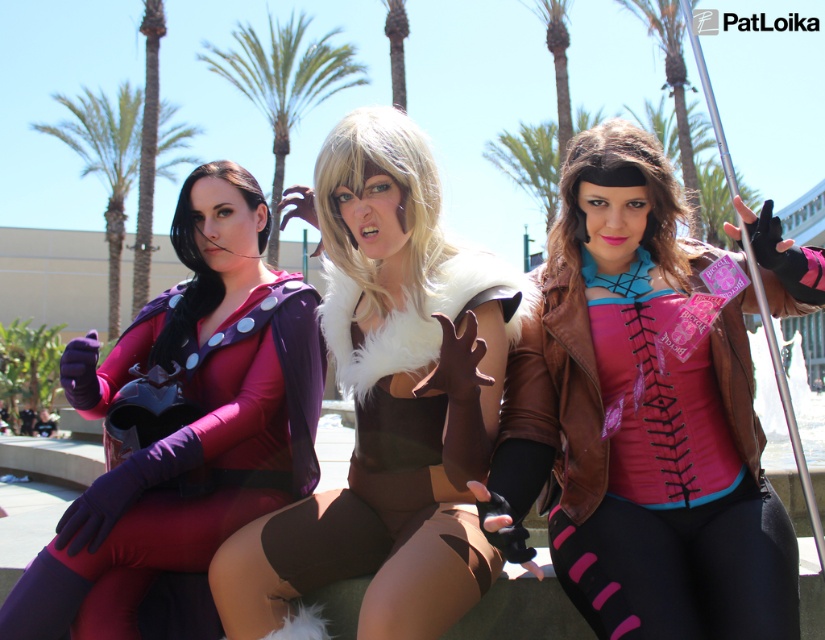
Question: Among these points, which one is nearest to the camera?

Choices:
 (A) click(307, 20)
 (B) click(343, 260)

Answer: (B)

Question: Is the position of brown fur vest at center more distant than that of green leafy palm tree at left?

Choices:
 (A) yes
 (B) no

Answer: (B)

Question: Estimate the real-world distances between objects in this image. Which object is farther from the matte purple bodysuit at left?

Choices:
 (A) green leafy palm tree at left
 (B) pink leather vest at center
 (C) green leafy palm tree at upper center
 (D) brown fur vest at center

Answer: (A)

Question: Is brown fur vest at center above green leafy palm tree at left?

Choices:
 (A) yes
 (B) no

Answer: (B)

Question: Is matte purple bodysuit at left to the left of green leafy palm tree at left from the viewer's perspective?

Choices:
 (A) yes
 (B) no

Answer: (B)

Question: Estimate the real-world distances between objects in this image. Which object is farther from the green leafy palm tree at left?

Choices:
 (A) matte purple bodysuit at left
 (B) brown fur vest at center
 (C) pink leather vest at center
 (D) green leafy palm tree at upper center

Answer: (B)